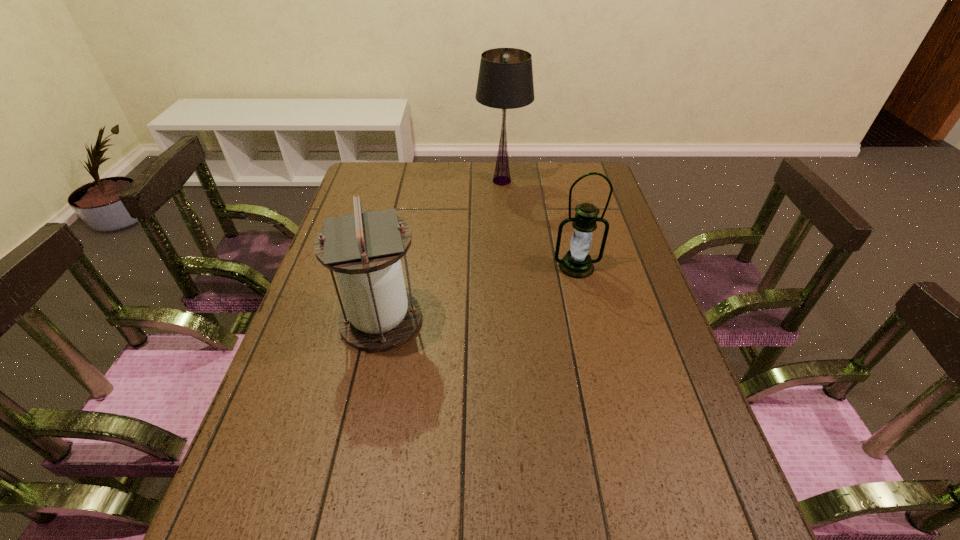
Locate an element on the screen. This screenshot has height=540, width=960. object that is at the left edge is located at coordinates (364, 248).

Locate an element on the screen. This screenshot has height=540, width=960. object that is at the right edge is located at coordinates (577, 263).

Locate an element on the screen. The height and width of the screenshot is (540, 960). free spot at the far edge of the desktop is located at coordinates (492, 173).

Where is `vacant position at the left edge of the desktop`? vacant position at the left edge of the desktop is located at coordinates (283, 390).

This screenshot has height=540, width=960. I want to click on vacant space at the right edge of the desktop, so click(628, 249).

At what (x,y) coordinates should I click in order to perform the action: click on empty space that is in between the right lantern and the farthest object. Please return your answer as a coordinate pair (x, y). Looking at the image, I should click on (540, 224).

The image size is (960, 540). Identify the location of free space between the farther lantern and the tallest object. [x=540, y=224].

Image resolution: width=960 pixels, height=540 pixels. In order to click on empty location between the lampshade and the second farthest object in this screenshot , I will do `click(540, 224)`.

At what (x,y) coordinates should I click in order to perform the action: click on vacant point located between the second object from left to right and the nearer lantern. Please return your answer as a coordinate pair (x, y). The image size is (960, 540). Looking at the image, I should click on (x=442, y=251).

Image resolution: width=960 pixels, height=540 pixels. Identify the location of empty space between the second object from left to right and the right lantern. [x=540, y=224].